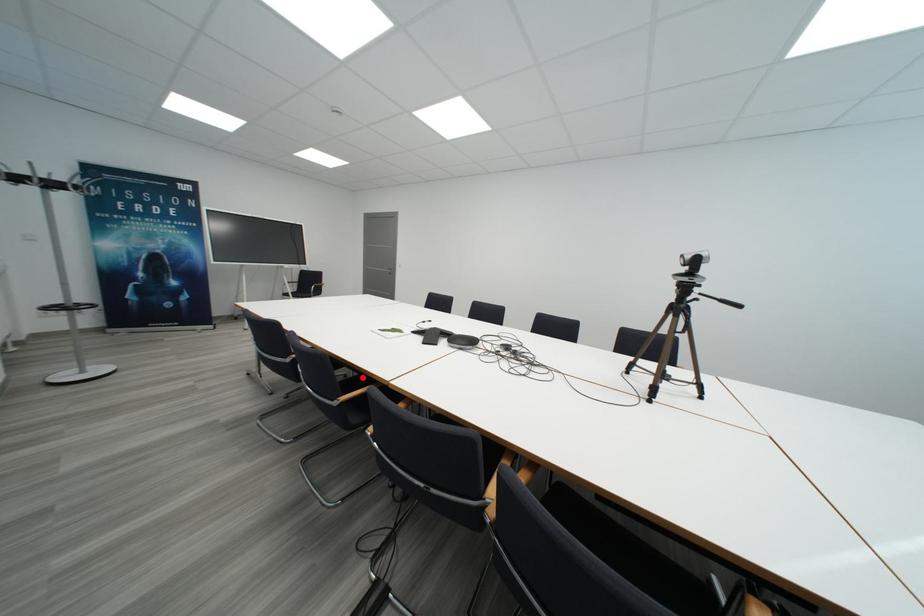
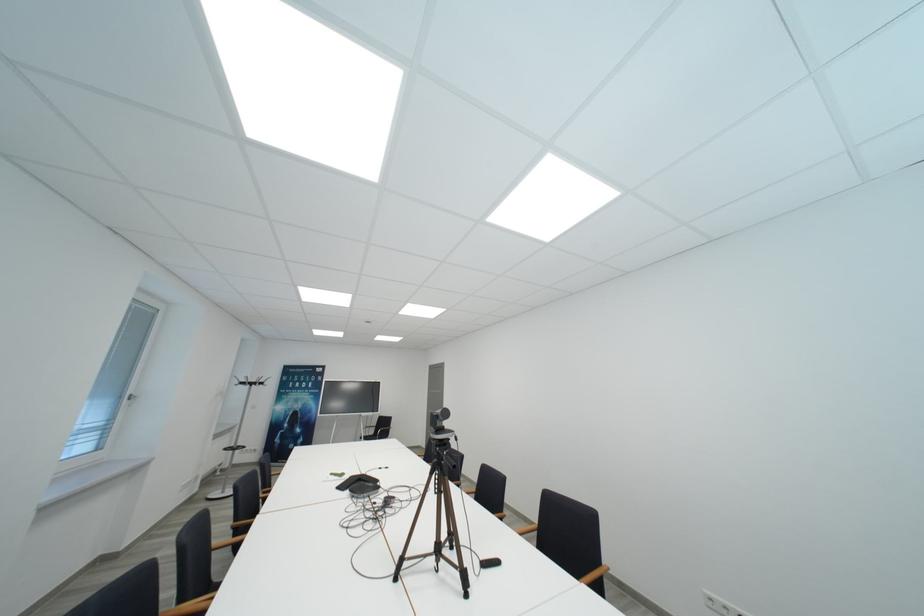
Question: I am providing you with two images of the same scene from different viewpoints. A red point is marked on the first image. At the location where the point appears in image 1, is it still visible in image 2?

Choices:
 (A) Yes
 (B) No

Answer: (B)